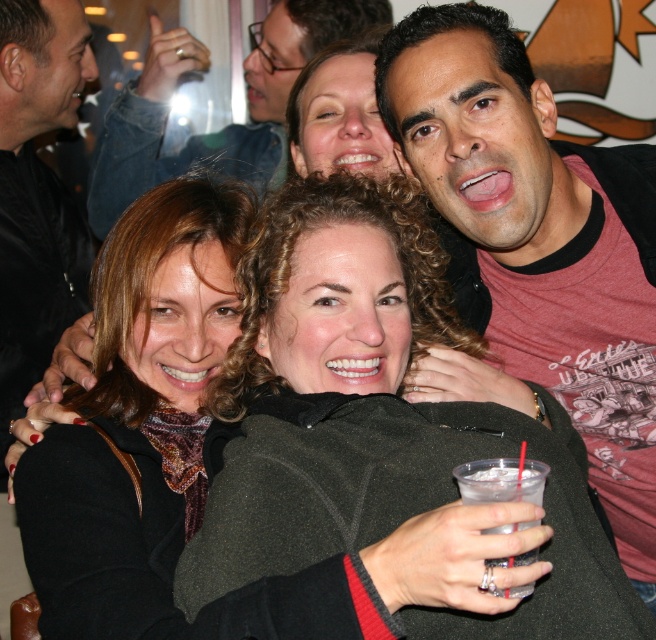
You are a photographer adjusting your camera settings to capture a clear photo of both the matte red shirt at upper right and the matte black scarf at center. Given that your camera has a depth of field that can focus on objects within a 45 cm range, will both items be in focus?

The matte red shirt at upper right is 44.26 centimeters away from the matte black scarf at center. Since the distance between them is within the camera lens depth of field range of 45 cm, both items will be in focus.

Consider the image. You are a photographer trying to capture a shot of both the matte black scarf at center and the clear plastic cup at lower center. Which object should you adjust your camera focus to first to ensure both are in the frame?

The matte black scarf at center is closer to the viewer than the clear plastic cup at lower center. To ensure both are in focus, adjust your camera focus starting with the matte black scarf at center first, then the clear plastic cup at lower center.

You are at a social event and want to locate the matte red shirt at upper right and the matte black scarf at center. From the perspective of someone facing the scene, which object is positioned to the left?

The matte black scarf at center is to the left of the matte red shirt at upper right.